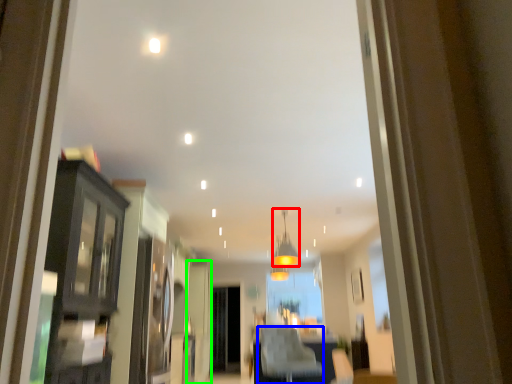
Question: Based on their relative distances, which object is nearer to light fixture (highlighted by a red box)? Choose from furniture (highlighted by a blue box) and door (highlighted by a green box).

Choices:
 (A) furniture
 (B) door

Answer: (B)